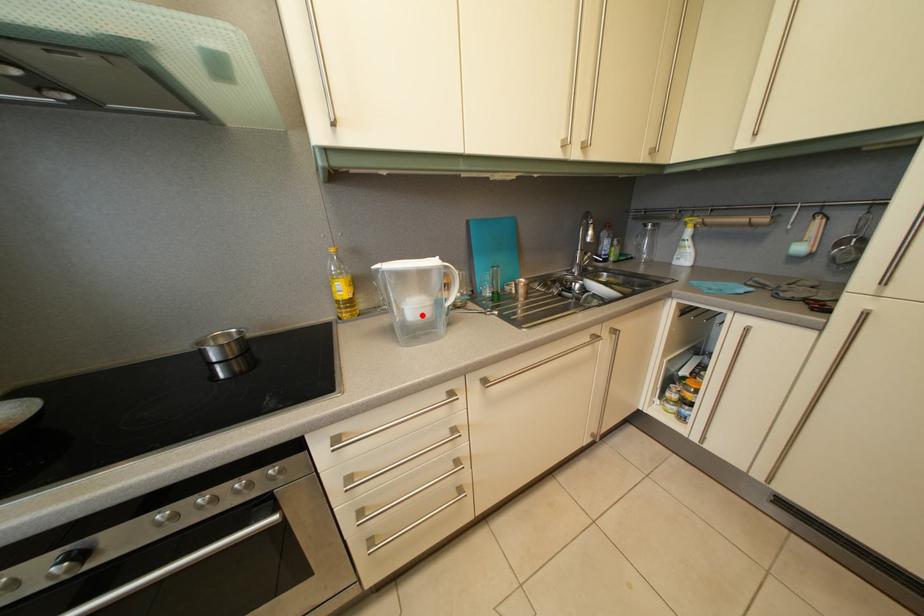
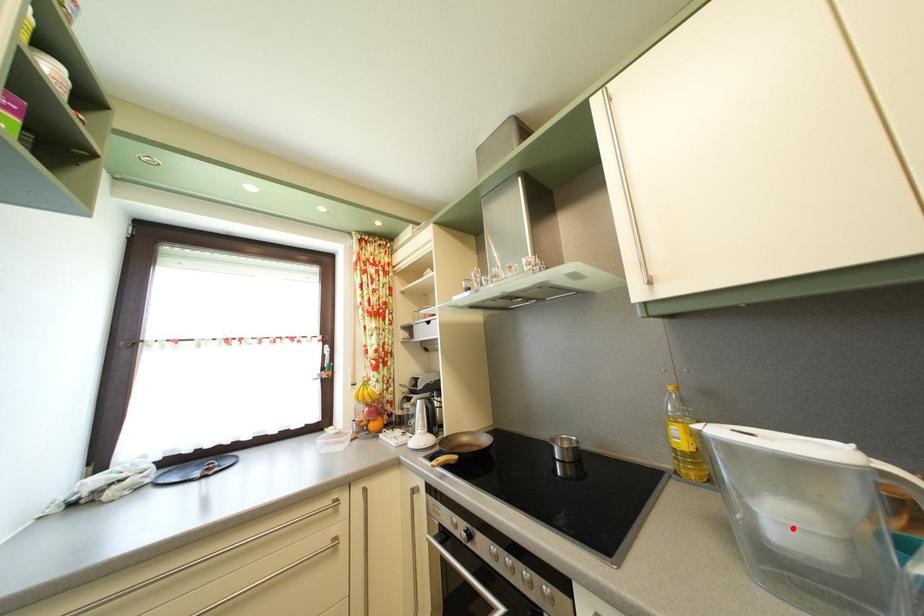
I am providing you with two images of the same scene from different viewpoints. A red point is marked on the first image and another point is marked on the second image. Is the marked point in image1 the same physical position as the marked point in image2?

Yes